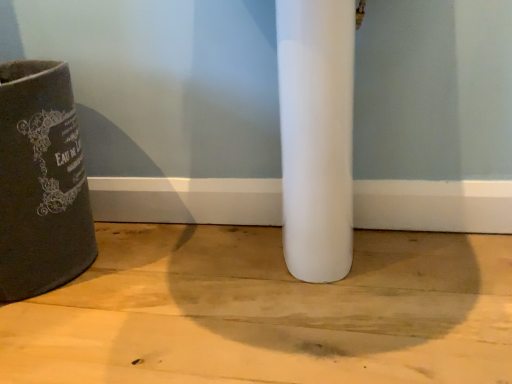
Question: Are white matte concrete at center and dark gray fabric waste container at left located far from each other?

Choices:
 (A) no
 (B) yes

Answer: (A)

Question: Can you confirm if white matte concrete at center is smaller than dark gray fabric waste container at left?

Choices:
 (A) no
 (B) yes

Answer: (B)

Question: Is white matte concrete at center at the right side of dark gray fabric waste container at left?

Choices:
 (A) yes
 (B) no

Answer: (A)

Question: Is the position of white matte concrete at center more distant than that of dark gray fabric waste container at left?

Choices:
 (A) no
 (B) yes

Answer: (A)

Question: Is white matte concrete at center in contact with dark gray fabric waste container at left?

Choices:
 (A) yes
 (B) no

Answer: (B)

Question: From a real-world perspective, is white matte concrete at center positioned over dark gray fabric waste container at left based on gravity?

Choices:
 (A) yes
 (B) no

Answer: (B)

Question: From the image's perspective, is dark gray fabric waste container at left beneath white matte concrete at center?

Choices:
 (A) yes
 (B) no

Answer: (B)

Question: From a real-world perspective, is dark gray fabric waste container at left beneath white matte concrete at center?

Choices:
 (A) no
 (B) yes

Answer: (A)

Question: Would you say dark gray fabric waste container at left is outside white matte concrete at center?

Choices:
 (A) yes
 (B) no

Answer: (A)

Question: Is dark gray fabric waste container at left next to white matte concrete at center and touching it?

Choices:
 (A) no
 (B) yes

Answer: (A)

Question: Is dark gray fabric waste container at left oriented towards white matte concrete at center?

Choices:
 (A) no
 (B) yes

Answer: (A)

Question: Is the position of dark gray fabric waste container at left less distant than that of white matte concrete at center?

Choices:
 (A) yes
 (B) no

Answer: (B)

Question: Is point (366, 274) positioned closer to the camera than point (8, 294)?

Choices:
 (A) farther
 (B) closer

Answer: (A)